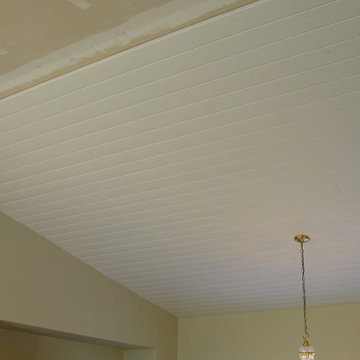
This screenshot has width=360, height=360. Find the location of `white light`. white light is located at coordinates (304, 357).